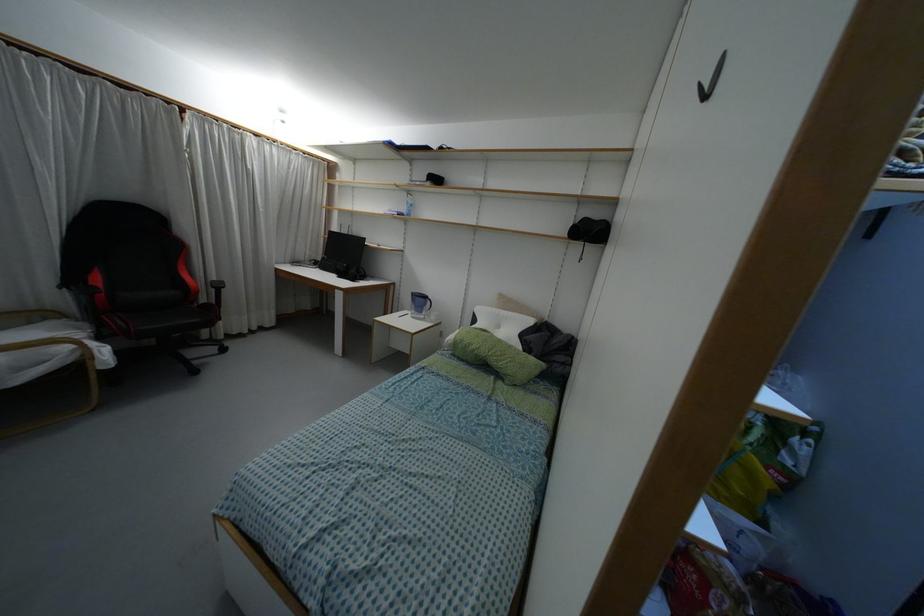
Find where to resting head the white pillow. Please return your answer as a coordinate pair (x, y).

(501, 321)